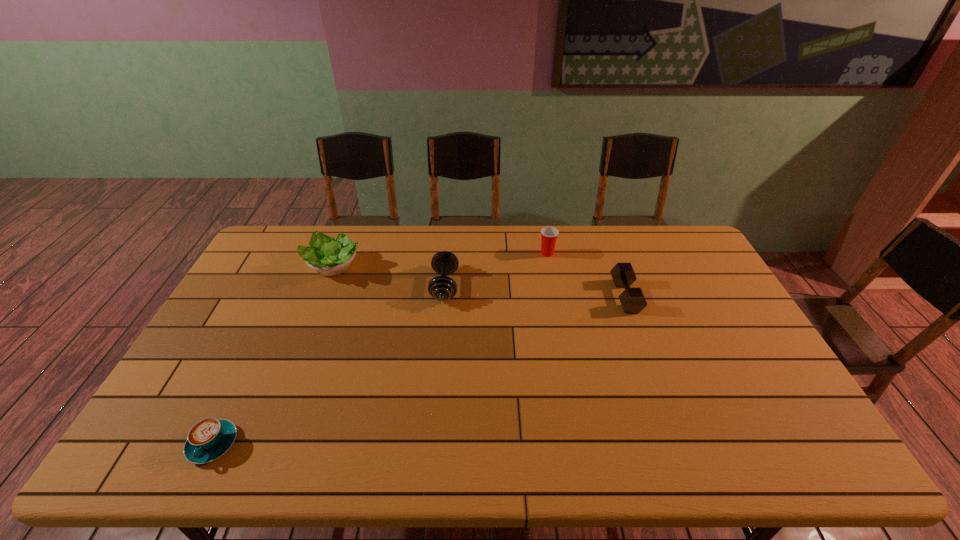
Locate an element on the screen. This screenshot has width=960, height=540. blank space at the right edge of the desktop is located at coordinates (786, 399).

The image size is (960, 540). In order to click on vacant region at the far left corner of the desktop in this screenshot , I will do `click(299, 239)`.

Image resolution: width=960 pixels, height=540 pixels. What are the coordinates of `vacant region at the far right corner` in the screenshot? It's located at (704, 265).

What are the coordinates of `vacant point located between the shorter dumbbell and the Dixie cup` in the screenshot? It's located at (587, 275).

Locate an element on the screen. Image resolution: width=960 pixels, height=540 pixels. vacant area that lies between the Dixie cup and the taller dumbbell is located at coordinates (495, 269).

The image size is (960, 540). What are the coordinates of `free spot between the Dixie cup and the third object from left to right` in the screenshot? It's located at (495, 269).

I want to click on empty location between the lettuce and the left dumbbell, so click(388, 277).

The image size is (960, 540). I want to click on vacant space in between the third object from left to right and the shorter dumbbell, so click(x=535, y=291).

Identify the location of free spot between the nearest object and the lettuce. This screenshot has width=960, height=540. (273, 356).

At what (x,y) coordinates should I click in order to perform the action: click on free space between the third object from left to right and the fourth object from left to right. Please return your answer as a coordinate pair (x, y). Looking at the image, I should click on (495, 269).